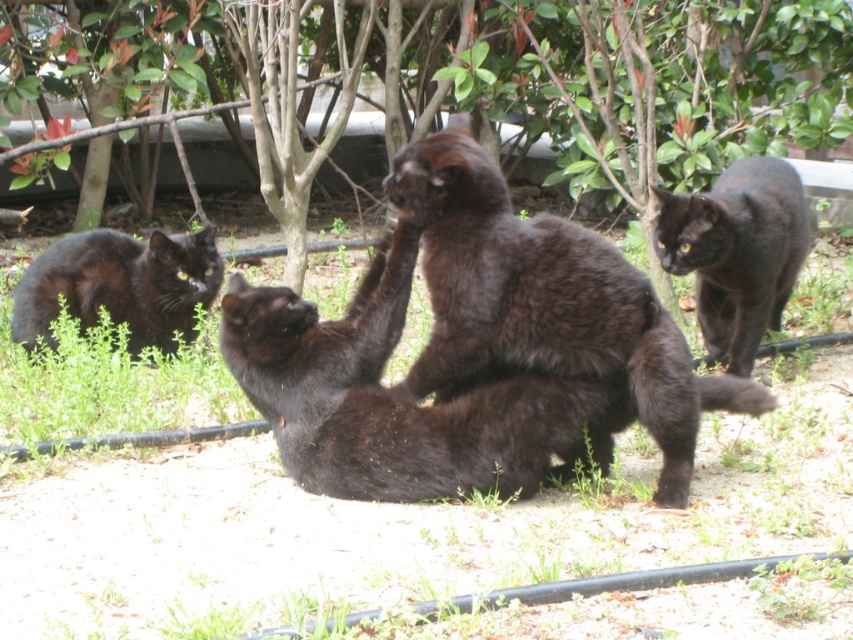
In the scene shown: Does shiny dark brown cat at center appear on the left side of shiny black cat at center?

Incorrect, shiny dark brown cat at center is not on the left side of shiny black cat at center.

Who is higher up, shiny dark brown cat at center or shiny black cat at center?

shiny dark brown cat at center

Find the location of `shiny dark brown cat at center`. shiny dark brown cat at center is located at coordinates (544, 301).

Is shiny dark brown cat at center to the right of matte black cat at left from the viewer's perspective?

Indeed, shiny dark brown cat at center is positioned on the right side of matte black cat at left.

Between point (454, 186) and point (178, 307), which one is positioned in front?

Point (454, 186)

The height and width of the screenshot is (640, 853). Find the location of `shiny dark brown cat at center`. shiny dark brown cat at center is located at coordinates (544, 301).

Between matte black cat at upper right and matte black cat at left, which one has less height?

A: With less height is matte black cat at left.

Identify the location of matte black cat at upper right. (735, 252).